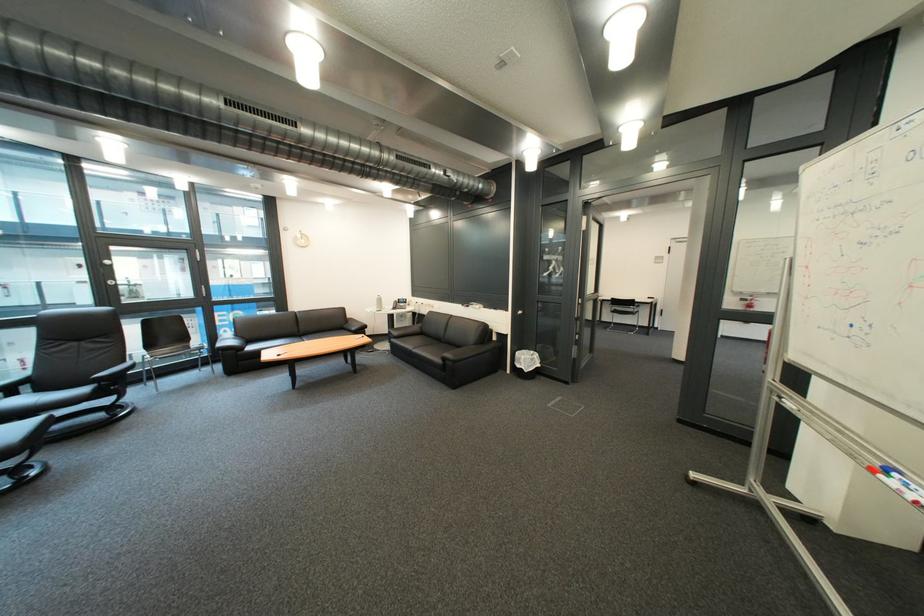
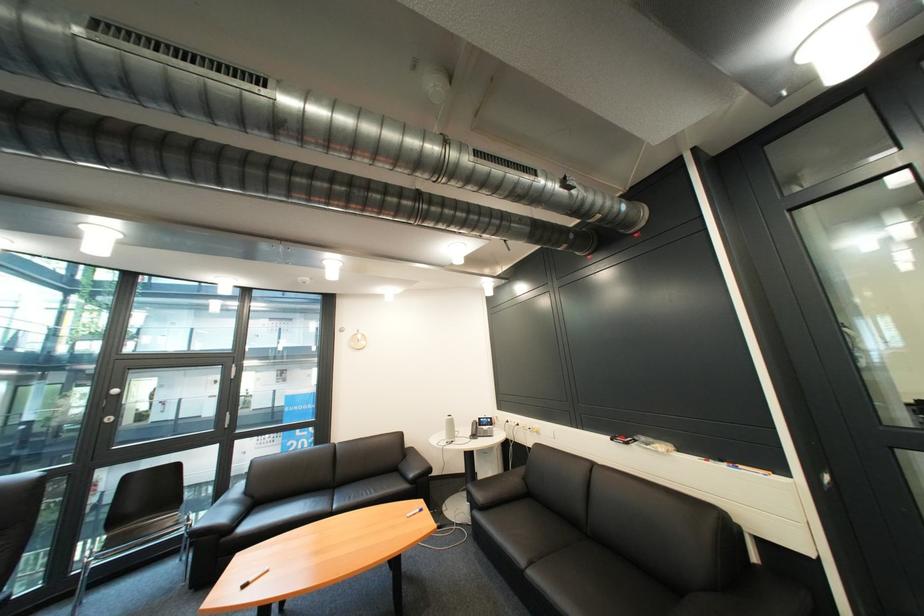
Find the pixel in the second image that matches (411,301) in the first image.

(492, 419)